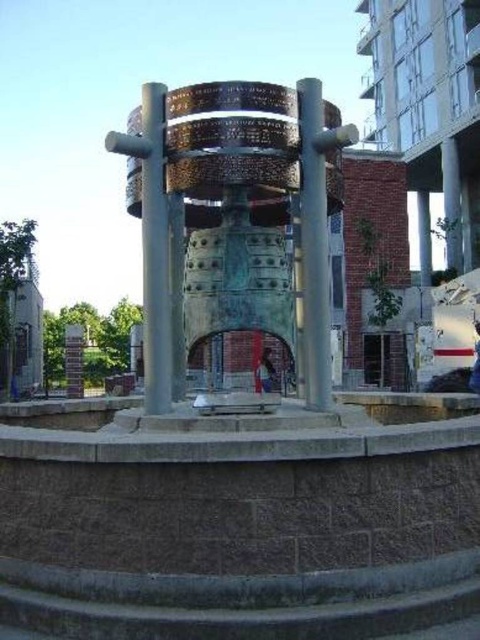
Question: Can you confirm if metallic polished pole at center is positioned below polished bronze pillar at center?

Choices:
 (A) yes
 (B) no

Answer: (B)

Question: Is bronze textured bell at center in front of polished bronze pillar at center?

Choices:
 (A) no
 (B) yes

Answer: (B)

Question: Which point is farther to the camera?

Choices:
 (A) (155, 396)
 (B) (223, 305)
 (C) (317, 154)

Answer: (B)

Question: Which of the following is the closest to the observer?

Choices:
 (A) polished bronze pillar at center
 (B) bronze textured bell at center
 (C) metallic polished pole at center

Answer: (B)

Question: Which object appears farthest from the camera in this image?

Choices:
 (A) polished bronze pillar at center
 (B) metallic polished pole at center
 (C) bronze textured bell at center

Answer: (A)

Question: Can you confirm if bronze textured bell at center is positioned to the left of polished bronze pillar at center?

Choices:
 (A) no
 (B) yes

Answer: (A)